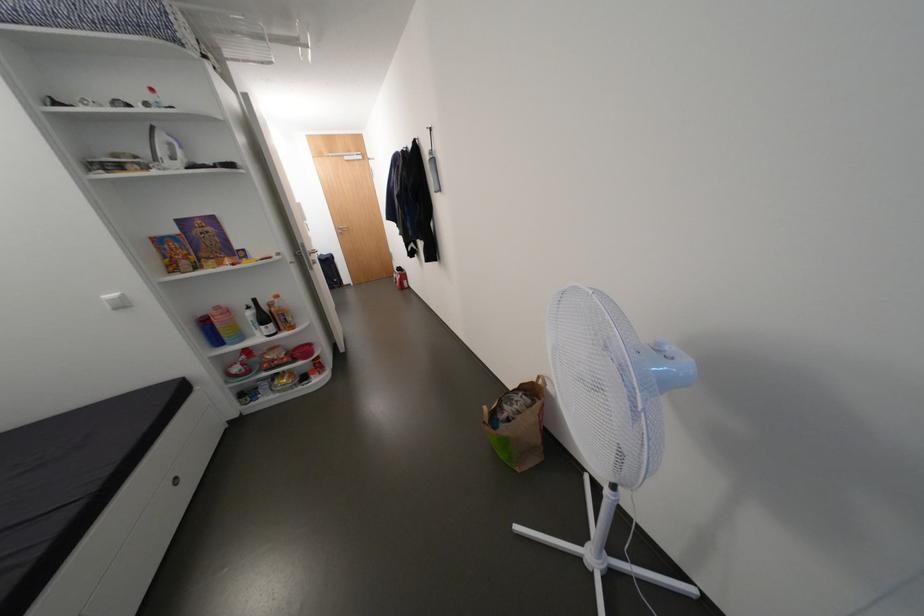
Find the location of `white light switch`. white light switch is located at coordinates (116, 301).